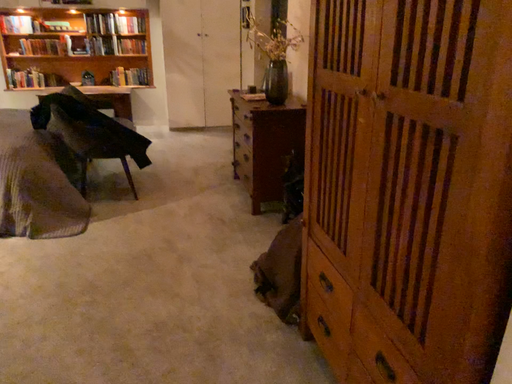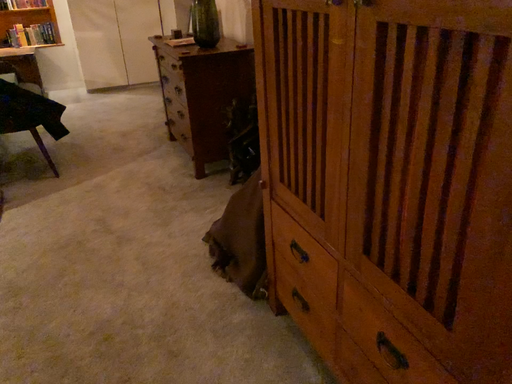
Question: How did the camera likely rotate when shooting the video?

Choices:
 (A) rotated left
 (B) rotated right

Answer: (B)